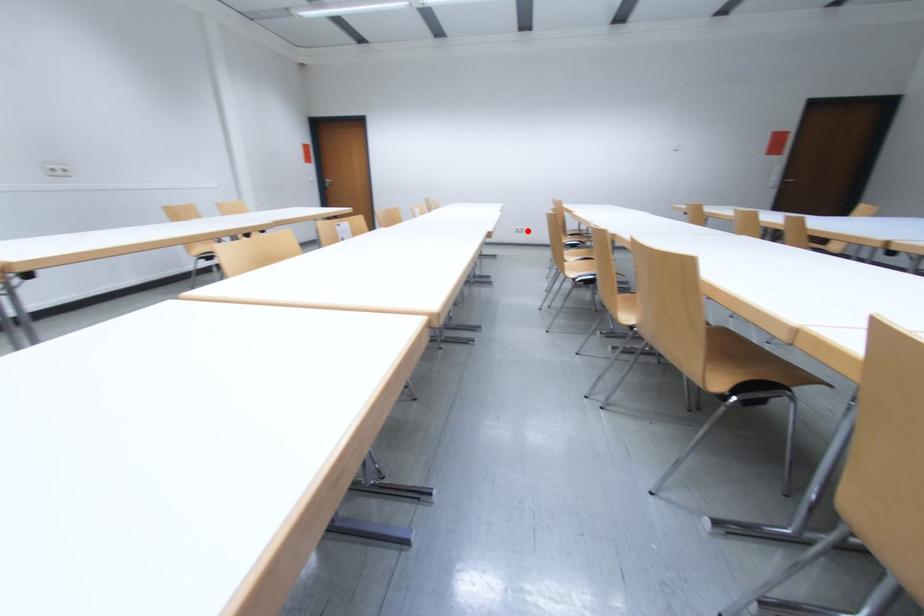
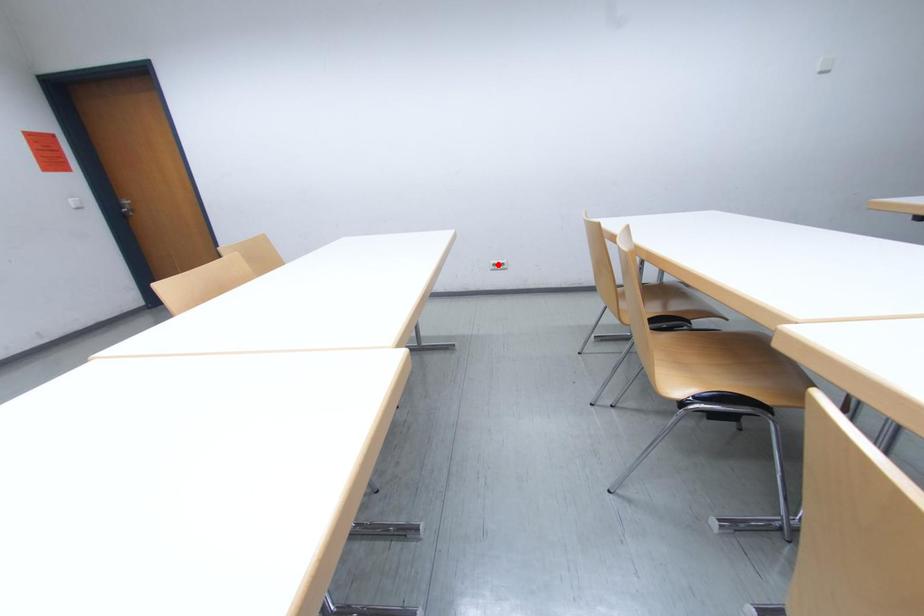
I am providing you with two images of the same scene from different viewpoints. A red point is marked on the first image and another point is marked on the second image. Are the points marked in image1 and image2 representing the same 3D position?

No